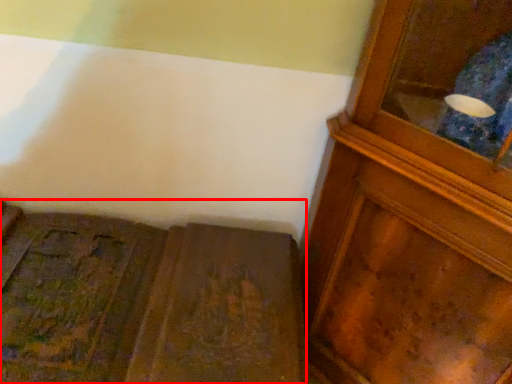
Question: From the image's perspective, where is furniture (annotated by the red box) located relative to cupboard?

Choices:
 (A) below
 (B) above

Answer: (A)